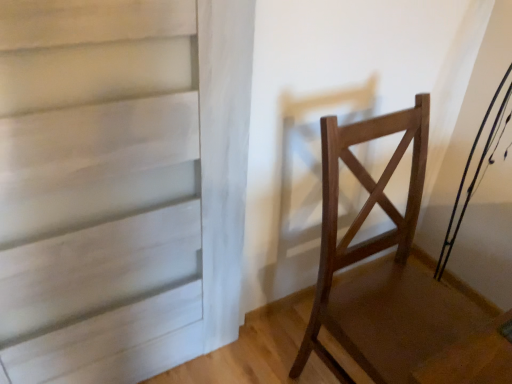
Question: Is wooden chair at right taller or shorter than white matte door at center?

Choices:
 (A) tall
 (B) short

Answer: (B)

Question: In terms of width, does wooden chair at right look wider or thinner when compared to white matte door at center?

Choices:
 (A) thin
 (B) wide

Answer: (B)

Question: From a real-world perspective, relative to white matte door at center, is wooden chair at right vertically above or below?

Choices:
 (A) above
 (B) below

Answer: (B)

Question: From a real-world perspective, is white matte door at center above or below wooden chair at right?

Choices:
 (A) above
 (B) below

Answer: (A)

Question: Is white matte door at center bigger or smaller than wooden chair at right?

Choices:
 (A) big
 (B) small

Answer: (B)

Question: In terms of width, does white matte door at center look wider or thinner when compared to wooden chair at right?

Choices:
 (A) wide
 (B) thin

Answer: (B)

Question: Is white matte door at center to the left or to the right of wooden chair at right in the image?

Choices:
 (A) right
 (B) left

Answer: (B)